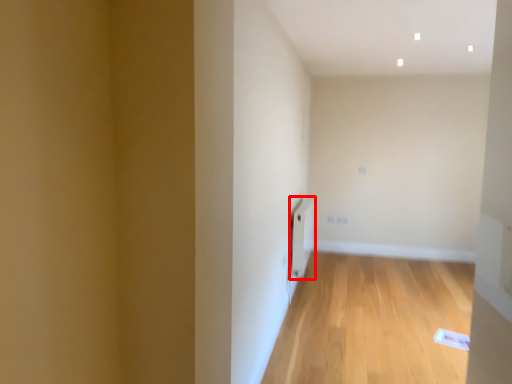
Question: From the image's perspective, where is radiator (annotated by the red box) located relative to corridor?

Choices:
 (A) above
 (B) below

Answer: (A)